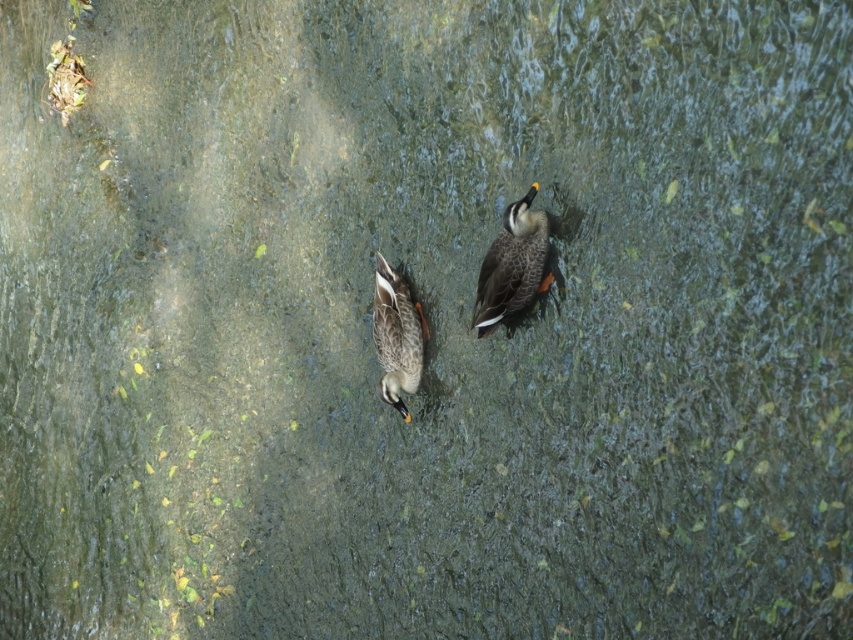
You are standing at the camera position and want to throw a small stone to hit the point at coordinates point (482, 276). If your throwing range is up to 3 meters, will you be able to reach that point?

The distance of point (482, 276) from camera is 3.25 meters, which is beyond your throwing range of 3 meters. Therefore, you cannot reach that point.

You are observing two ducks in a pond. The speckled brown duck at upper right and the speckled brown duck at center are both swimming. Which duck is positioned more to the right side of the frame?

The speckled brown duck at upper right is positioned more to the right side of the frame compared to the speckled brown duck at center.

You are a wildlife photographer observing two speckled brown ducks in a pond. You need to capture a photo of both the speckled brown duck at upper right and the speckled brown duck at center. Which duck would appear smaller in the photo?

The speckled brown duck at upper right would appear smaller in the photo because it occupies less space than the speckled brown duck at center.